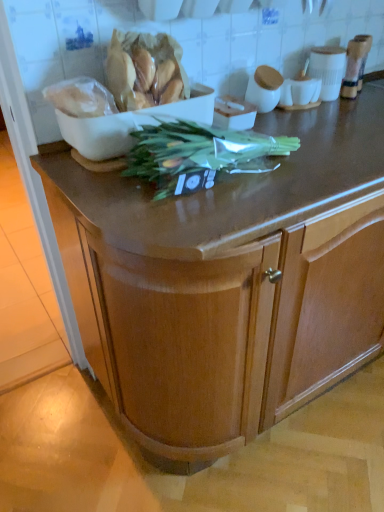
Question: Is white glossy cup at upper right taller or shorter than translucent plastic bag of bread at upper left, the 2th food from the left?

Choices:
 (A) tall
 (B) short

Answer: (B)

Question: Is white glossy cup at upper right in front of or behind translucent plastic bag of bread at upper left, the 2th food from the left, in the image?

Choices:
 (A) front
 (B) behind

Answer: (B)

Question: Based on their relative distances, which object is farther from the green leafy vegetable at center?

Choices:
 (A) wooden cabinet at center
 (B) white plastic bag at upper left, which appears as the 1th food when viewed from the left
 (C) white glossy cup at upper right
 (D) white matte bowl at upper left
 (E) translucent plastic bag of bread at upper left, the 1th food when ordered from right to left

Answer: (C)

Question: Based on their relative distances, which object is farther from the wooden cabinet at center?

Choices:
 (A) translucent plastic bag of bread at upper left, the 1th food when ordered from right to left
 (B) green leafy vegetable at center
 (C) white glossy cup at upper right
 (D) white matte bowl at upper left
 (E) white plastic bag at upper left, positioned as the second food in right-to-left order

Answer: (C)